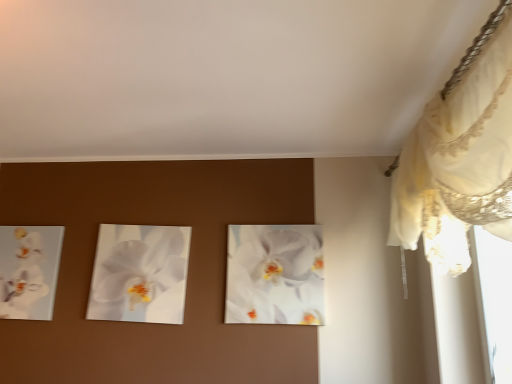
Question: Which direction should I rotate to look at white glossy orchid at center, the 2th flower when ordered from right to left?

Choices:
 (A) right
 (B) left

Answer: (B)

Question: Does white glossy orchid at left, which ranks as the third flower in right-to-left order, appear on the right side of white lace curtain at upper right?

Choices:
 (A) no
 (B) yes

Answer: (A)

Question: From a real-world perspective, is white glossy orchid at left, which appears as the 1th flower when viewed from the left, positioned under white lace curtain at upper right based on gravity?

Choices:
 (A) no
 (B) yes

Answer: (B)

Question: Is white glossy orchid at left, which appears as the 1th flower when viewed from the left, to the left of white lace curtain at upper right from the viewer's perspective?

Choices:
 (A) no
 (B) yes

Answer: (B)

Question: From the image's perspective, is white glossy orchid at left, which ranks as the third flower in right-to-left order, on white lace curtain at upper right?

Choices:
 (A) yes
 (B) no

Answer: (B)

Question: Can you confirm if white glossy orchid at left, which appears as the 1th flower when viewed from the left, is thinner than white lace curtain at upper right?

Choices:
 (A) yes
 (B) no

Answer: (A)

Question: Is white glossy orchid at left, which appears as the 1th flower when viewed from the left, not near white lace curtain at upper right?

Choices:
 (A) yes
 (B) no

Answer: (A)

Question: Would you consider white glossy orchid at center, which is the 2th flower from left to right, to be distant from white glossy orchid at left, which appears as the 1th flower when viewed from the left?

Choices:
 (A) yes
 (B) no

Answer: (B)

Question: Considering the relative positions of white glossy orchid at center, which is the 2th flower from left to right, and white glossy orchid at left, which ranks as the third flower in right-to-left order, in the image provided, is white glossy orchid at center, which is the 2th flower from left to right, to the left of white glossy orchid at left, which ranks as the third flower in right-to-left order, from the viewer's perspective?

Choices:
 (A) no
 (B) yes

Answer: (A)

Question: Is white glossy orchid at center, which is the 2th flower from left to right, to the right of white glossy orchid at left, which ranks as the third flower in right-to-left order, from the viewer's perspective?

Choices:
 (A) no
 (B) yes

Answer: (B)

Question: Can you confirm if white glossy orchid at center, which is the 2th flower from left to right, is wider than white glossy orchid at left, which ranks as the third flower in right-to-left order?

Choices:
 (A) yes
 (B) no

Answer: (B)

Question: Does white glossy orchid at center, which is the 2th flower from left to right, have a lesser width compared to white glossy orchid at left, which appears as the 1th flower when viewed from the left?

Choices:
 (A) yes
 (B) no

Answer: (A)

Question: Does white glossy orchid at center, the 2th flower when ordered from right to left, have a greater height compared to white glossy orchid at left, which appears as the 1th flower when viewed from the left?

Choices:
 (A) yes
 (B) no

Answer: (A)

Question: Can you confirm if white lace curtain at upper right is wider than white glossy orchid at center, positioned as the first flower in right-to-left order?

Choices:
 (A) yes
 (B) no

Answer: (A)